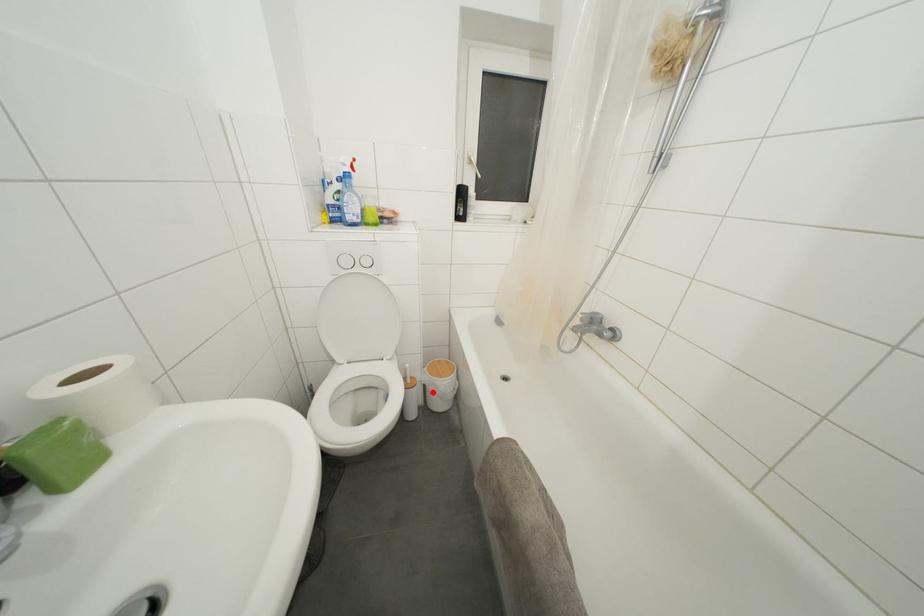
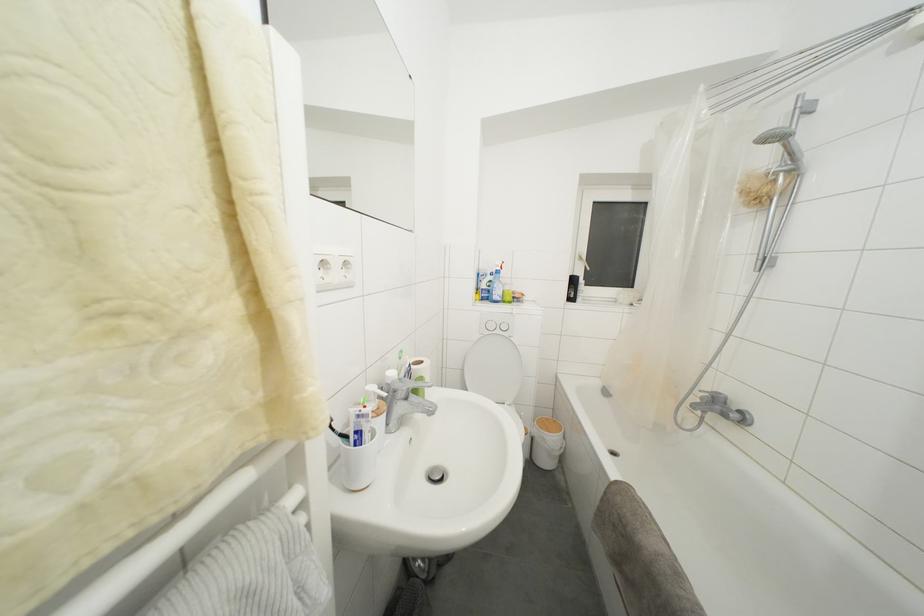
Locate, in the second image, the point that corresponds to the highlighted location in the first image.

(541, 445)